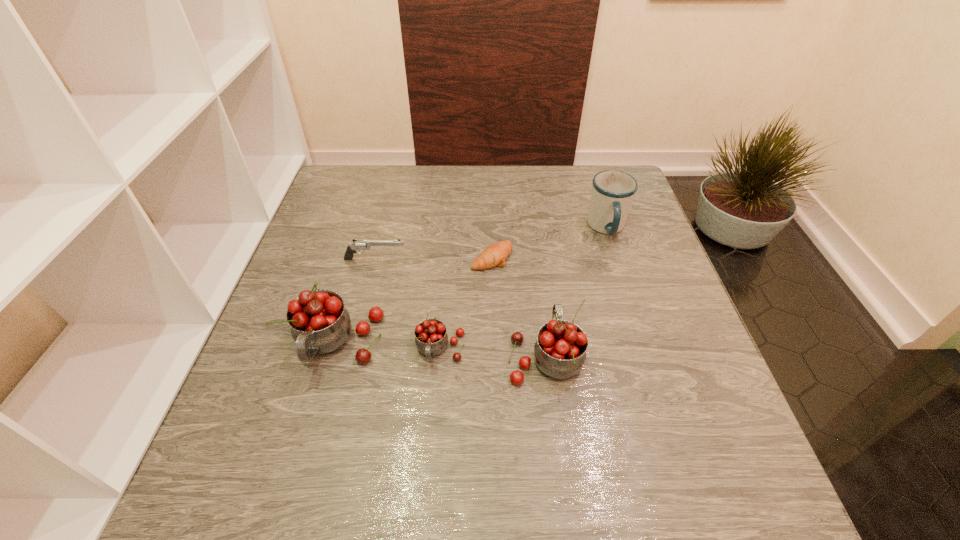
This screenshot has height=540, width=960. In order to click on free region located on the handle side of the rightmost cherry in this screenshot , I will do `click(528, 223)`.

The width and height of the screenshot is (960, 540). I want to click on vacant space located 0.280m on the handle side of the rightmost cherry, so click(531, 242).

Where is `free space located on the back of the shortest object`? free space located on the back of the shortest object is located at coordinates (490, 187).

Locate an element on the screen. free space located on the handle side of the mug is located at coordinates (626, 287).

Find the location of a particular element. This screenshot has width=960, height=540. vacant space located 0.060m on the front-facing side of the fifth tallest object is located at coordinates (431, 259).

I want to click on object at the far edge, so click(x=613, y=191).

This screenshot has height=540, width=960. Identify the location of cherry that is at the left edge. (320, 324).

Where is `pistol present at the left edge`? pistol present at the left edge is located at coordinates coord(359,245).

This screenshot has height=540, width=960. Find the location of `object that is positioned at the right edge`. object that is positioned at the right edge is located at coordinates (613, 191).

Where is `object at the far right corner`? object at the far right corner is located at coordinates (613, 191).